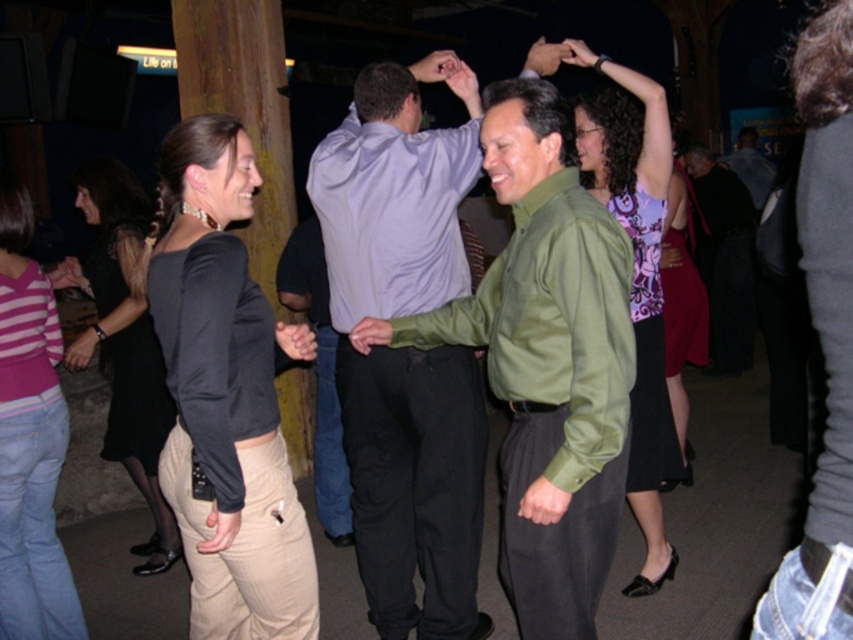
Question: Which of these objects is positioned farthest from the light purple satin shirt at center?

Choices:
 (A) light purple shirt at center
 (B) pink striped shirt at lower left
 (C) green shiny shirt at center
 (D) patterned fabric dress at upper right

Answer: (D)

Question: Which point is farther from the camera taking this photo?

Choices:
 (A) (68, 352)
 (B) (4, 618)
 (C) (738, 241)

Answer: (C)

Question: Is black satin dress at right above matte black shirt at center?

Choices:
 (A) no
 (B) yes

Answer: (A)

Question: Where is light purple shirt at center located in relation to matte black dress at lower left in the image?

Choices:
 (A) below
 (B) above

Answer: (B)

Question: Is patterned fabric dress at upper right thinner than printed silk blouse at upper right?

Choices:
 (A) no
 (B) yes

Answer: (B)

Question: Considering the real-world distances, which object is closest to the light purple satin shirt at center?

Choices:
 (A) khaki pants at lower left
 (B) matte black shirt at center

Answer: (A)